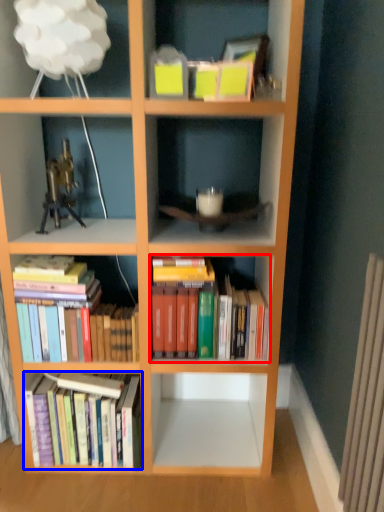
Question: Which object appears closest to the camera in this image, book (highlighted by a red box) or book (highlighted by a blue box)?

Choices:
 (A) book
 (B) book

Answer: (A)